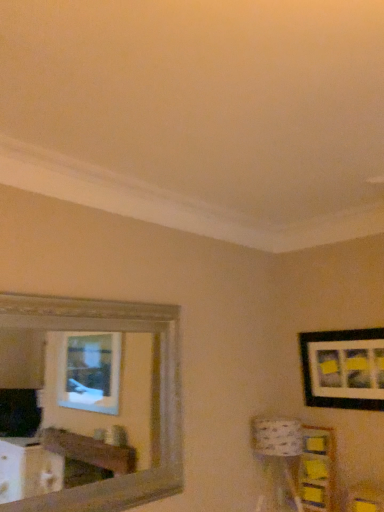
Question: In the image, is wooden frame mirror at upper left on the left side or the right side of black matte picture frame at upper right?

Choices:
 (A) right
 (B) left

Answer: (B)

Question: Relative to black matte picture frame at upper right, is wooden frame mirror at upper left in front or behind?

Choices:
 (A) behind
 (B) front

Answer: (B)

Question: Considering the real-world distances, which object is farthest from the wooden frame mirror at upper left?

Choices:
 (A) patterned fabric lampshade at lower right
 (B) black matte picture frame at upper right
 (C) yellow paper at lower right

Answer: (B)

Question: Which is farther from the wooden frame mirror at upper left?

Choices:
 (A) black matte picture frame at upper right
 (B) yellow paper at lower right
 (C) patterned fabric lampshade at lower right

Answer: (A)